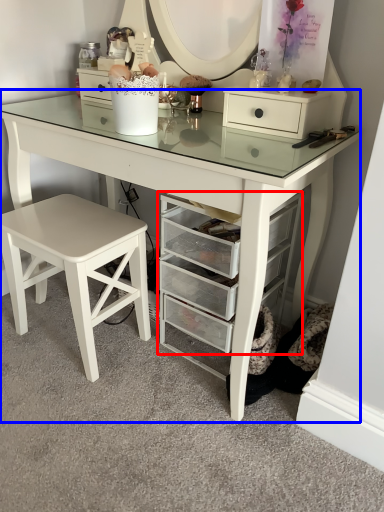
Question: Which of the following is the farthest to the observer, shelf (highlighted by a red box) or table (highlighted by a blue box)?

Choices:
 (A) shelf
 (B) table

Answer: (A)